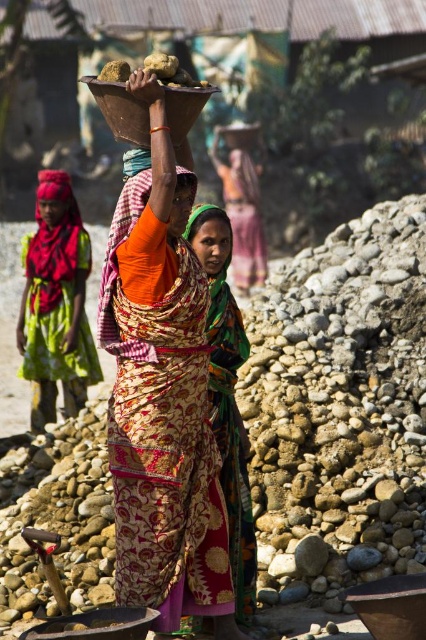
Is point (250, 147) farther from viewer compared to point (229, 221)?

Yes, point (250, 147) is behind point (229, 221).

Who is more distant from viewer, (233, 266) or (195, 236)?

The point (233, 266) is more distant.

Does point (236, 275) come in front of point (207, 253)?

That is False.

Locate an element on the screen. The height and width of the screenshot is (640, 426). orange fabric sari at center is located at coordinates (241, 204).

Who is more distant from viewer, (83, 276) or (229, 241)?

Point (83, 276)

Can you confirm if green fabric dress at left is positioned above multicolored fabric headscarf at center?

Yes.

Identify the location of green fabric dress at left. The width and height of the screenshot is (426, 640). (55, 305).

Is printed fabric sari at center further to the viewer compared to green fabric dress at left?

No, it is in front of green fabric dress at left.

Based on the photo, which is more to the right, printed fabric sari at center or green fabric dress at left?

From the viewer's perspective, printed fabric sari at center appears more on the right side.

Describe the element at coordinates (161, 403) in the screenshot. The image size is (426, 640). I see `printed fabric sari at center` at that location.

Where is `printed fabric sari at center`? The height and width of the screenshot is (640, 426). printed fabric sari at center is located at coordinates (161, 403).